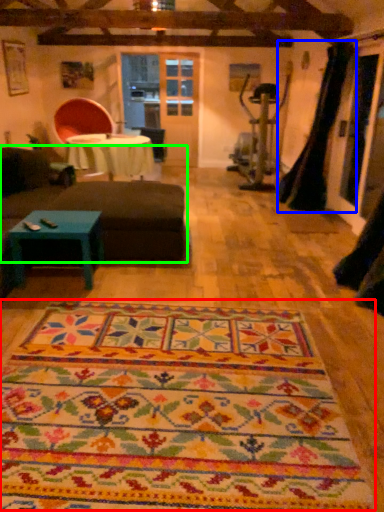
Question: Considering the real-world distances, which object is farthest from mat (highlighted by a red box)? curtain (highlighted by a blue box) or studio couch (highlighted by a green box)?

Choices:
 (A) curtain
 (B) studio couch

Answer: (A)